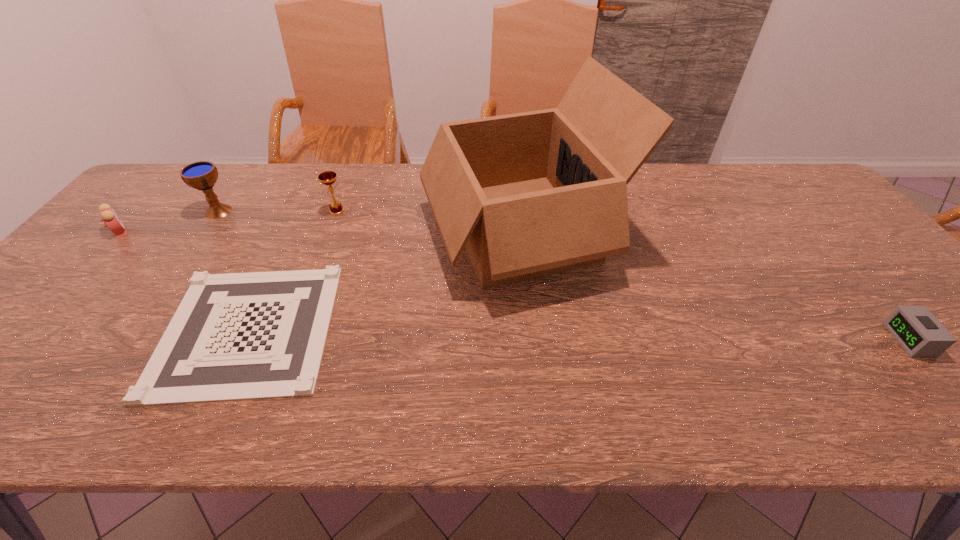
Where is `free area in between the tallest object and the left chalice`? free area in between the tallest object and the left chalice is located at coordinates (370, 220).

What are the coordinates of `unoccupied position between the left alarm clock and the box` in the screenshot? It's located at (321, 231).

This screenshot has width=960, height=540. I want to click on free space that is in between the fourth shortest object and the box, so tap(428, 220).

At what (x,y) coordinates should I click in order to perform the action: click on vacant point located between the tallest object and the shorter chalice. Please return your answer as a coordinate pair (x, y). The width and height of the screenshot is (960, 540). Looking at the image, I should click on (428, 220).

Find the location of a particular element. free spot between the shorter chalice and the leftmost object is located at coordinates (228, 221).

The width and height of the screenshot is (960, 540). I want to click on free point between the rightmost object and the left chalice, so click(564, 275).

Find the location of a particular element. The image size is (960, 540). vacant area that lies between the leftmost object and the shortest object is located at coordinates pyautogui.click(x=184, y=280).

Locate an element on the screen. empty space that is in between the right chalice and the fifth object from left to right is located at coordinates (428, 220).

The width and height of the screenshot is (960, 540). Find the location of `free area in between the fifth shortest object and the shorter chalice`. free area in between the fifth shortest object and the shorter chalice is located at coordinates (277, 211).

In order to click on object that is the fifth closest one to the tallest object in this screenshot , I will do [x=109, y=217].